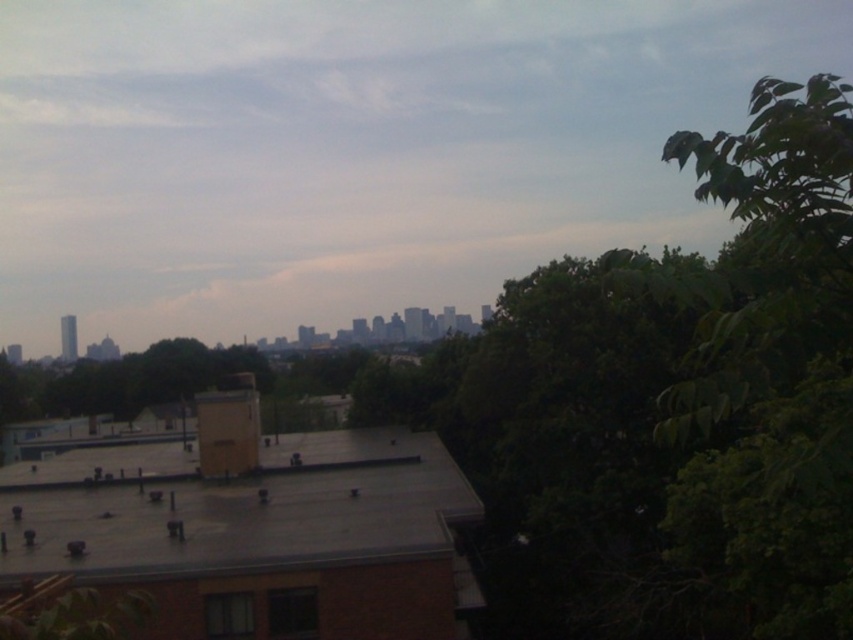
You are a city planner assessing rooftop space for potential solar panel installation. You observe the green leafy tree at right and the gray rubber roof at center. Which object has a greater width?

The green leafy tree at right has a greater width than the gray rubber roof at center.

You are a drone operator trying to fly a drone from the gray rubber roof at center to the green leafy tree at right. Considering their heights, will the drone need to ascend or descend to reach the tree?

The green leafy tree at right is much taller than the gray rubber roof at center, so the drone will need to ascend to reach the tree.

You are standing on the gray rubber roof at center and want to look towards the city skyline. Which direction should you turn to avoid the green leafy tree at right blocking your view?

You should turn to the left to avoid the green leafy tree at right blocking your view because the green leafy tree at right is to the right of the gray rubber roof at center, so turning left would move you away from the tree and towards an unobstructed view of the city skyline.